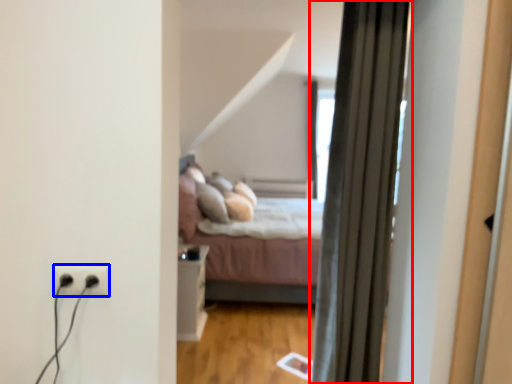
Question: Among these objects, which one is farthest to the camera, curtain (highlighted by a red box) or electric outlet (highlighted by a blue box)?

Choices:
 (A) curtain
 (B) electric outlet

Answer: (A)